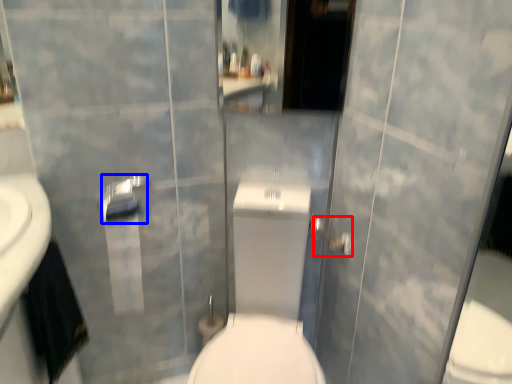
Question: Which point is further to the camera, shower (highlighted by a red box) or towel bar (highlighted by a blue box)?

Choices:
 (A) shower
 (B) towel bar

Answer: (A)